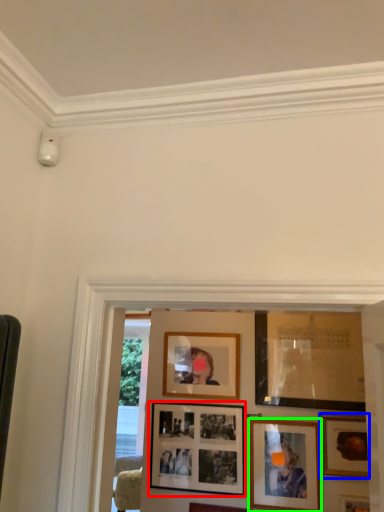
Question: Which object is the closest to the picture frame (highlighted by a red box)? Choose among these: picture frame (highlighted by a blue box) or picture frame (highlighted by a green box).

Choices:
 (A) picture frame
 (B) picture frame

Answer: (B)